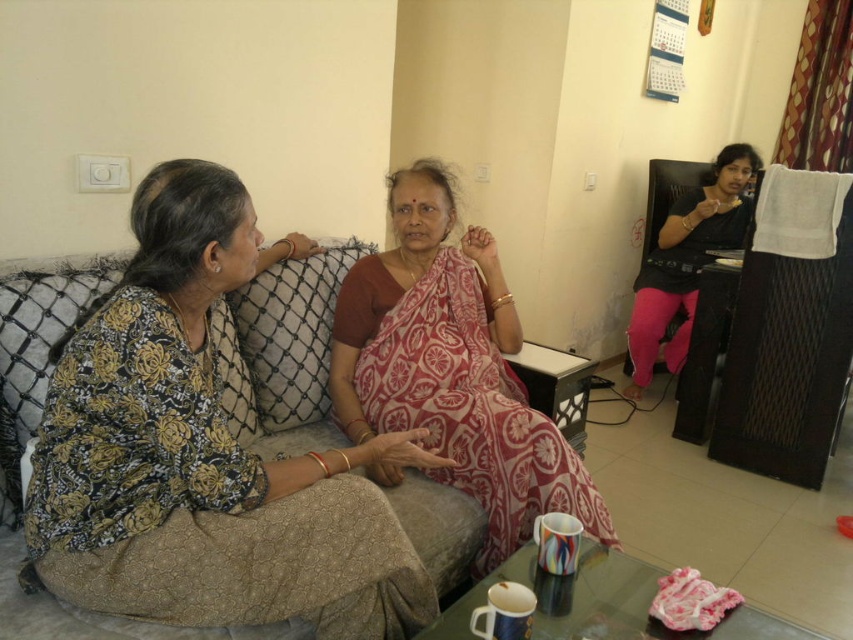
Between red floral saree at center and black matte chair at right, which one is positioned higher?

black matte chair at right is higher up.

Between red floral saree at center and black matte chair at right, which one has more height?

With more height is black matte chair at right.

This screenshot has height=640, width=853. In order to click on red floral saree at center in this screenshot , I will do `click(451, 369)`.

The height and width of the screenshot is (640, 853). Find the location of `red floral saree at center`. red floral saree at center is located at coordinates [451, 369].

Who is taller, beige fabric couch at center or black matte chair at right?

With more height is black matte chair at right.

Looking at this image, is beige fabric couch at center thinner than black matte chair at right?

In fact, beige fabric couch at center might be wider than black matte chair at right.

Does point (398, 492) come in front of point (701, 224)?

That is True.

Find the location of a particular element. The width and height of the screenshot is (853, 640). beige fabric couch at center is located at coordinates (99, 616).

Identify the location of red floral saree at center. This screenshot has width=853, height=640. (451, 369).

Is red floral saree at center shorter than beige fabric couch at center?

Incorrect, red floral saree at center's height does not fall short of beige fabric couch at center's.

What do you see at coordinates (451, 369) in the screenshot? The image size is (853, 640). I see `red floral saree at center` at bounding box center [451, 369].

Find the location of a particular element. red floral saree at center is located at coordinates (451, 369).